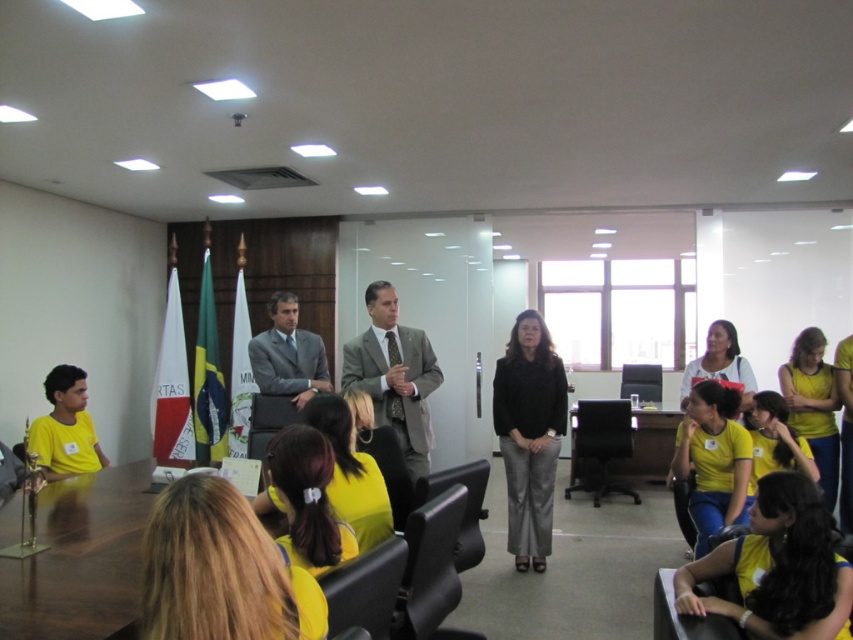
From the picture: Is gray suit at center taller than black plastic table at center?

Yes.

Is point (381, 378) positioned in front of point (634, 481)?

Yes, it is.

Between point (421, 352) and point (576, 433), which one is positioned behind?

Positioned behind is point (576, 433).

Find the location of a particular element. gray suit at center is located at coordinates (x=393, y=374).

Can you confirm if yellow matte shirt at lower left is positioned to the right of matte gray suit at center?

No, yellow matte shirt at lower left is not to the right of matte gray suit at center.

Who is positioned more to the right, yellow matte shirt at lower left or matte gray suit at center?

Positioned to the right is matte gray suit at center.

Find the location of a particular element. yellow matte shirt at lower left is located at coordinates (65, 428).

The height and width of the screenshot is (640, 853). Find the location of `yellow matte shirt at lower left`. yellow matte shirt at lower left is located at coordinates (65, 428).

Who is positioned more to the left, blonde hair at lower center or yellow fabric shirt at lower right?

blonde hair at lower center is more to the left.

Between blonde hair at lower center and yellow fabric shirt at lower right, which one has less height?

Standing shorter between the two is blonde hair at lower center.

You are a GUI agent. You are given a task and a screenshot of the screen. Output one action in this format:
    pyautogui.click(x=<x>, y=<y>)
    Task: Click on the blonde hair at lower center
    
    Given the screenshot: What is the action you would take?
    pyautogui.click(x=219, y=570)